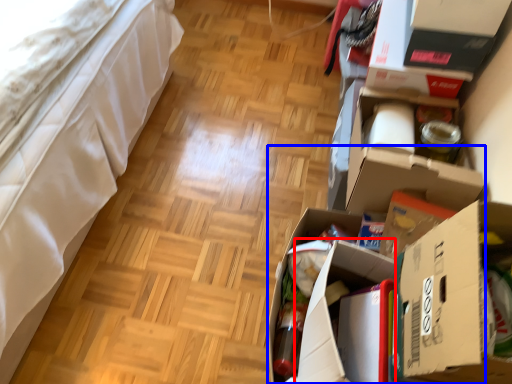
Question: Which object appears farthest to the camera in this image, cardboard box (highlighted by a red box) or cardboard box (highlighted by a blue box)?

Choices:
 (A) cardboard box
 (B) cardboard box

Answer: (A)